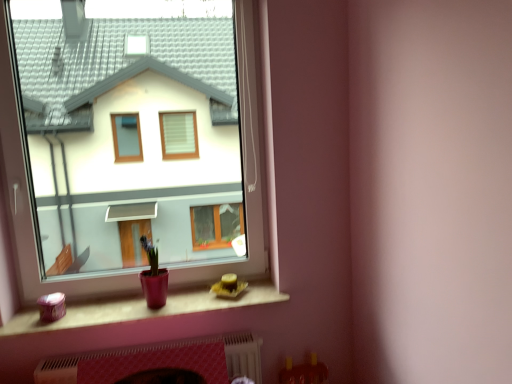
Where is `empty space that is ontop of matte plastic window sill at lower center`? This screenshot has height=384, width=512. empty space that is ontop of matte plastic window sill at lower center is located at coordinates (157, 308).